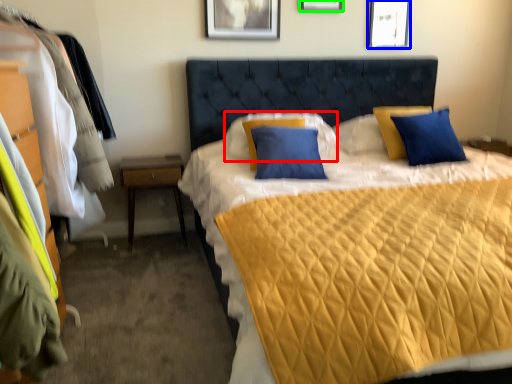
Question: Estimate the real-world distances between objects in this image. Which object is farther from pillow (highlighted by a red box), picture frame (highlighted by a blue box) or picture frame (highlighted by a green box)?

Choices:
 (A) picture frame
 (B) picture frame

Answer: (A)